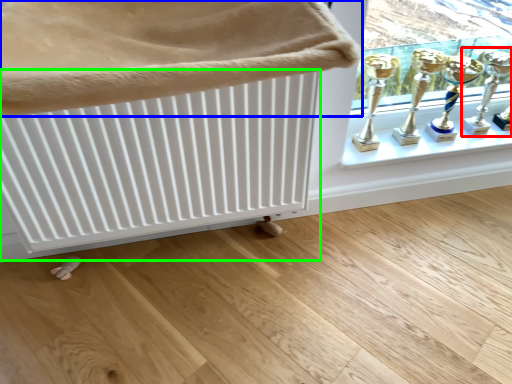
Question: Which is farther away from candle holder (highlighted by a red box)? furniture (highlighted by a blue box) or radiator (highlighted by a green box)?

Choices:
 (A) furniture
 (B) radiator

Answer: (A)